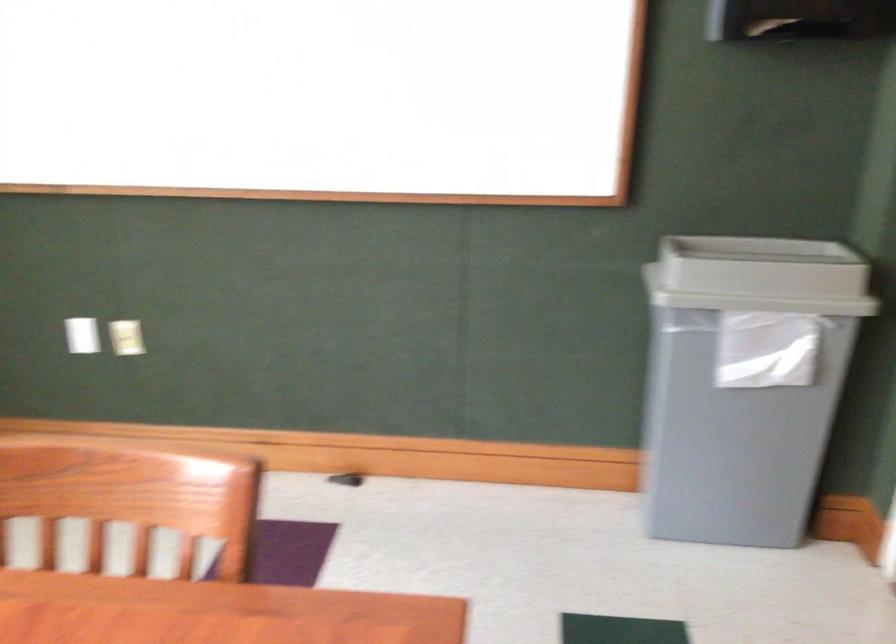
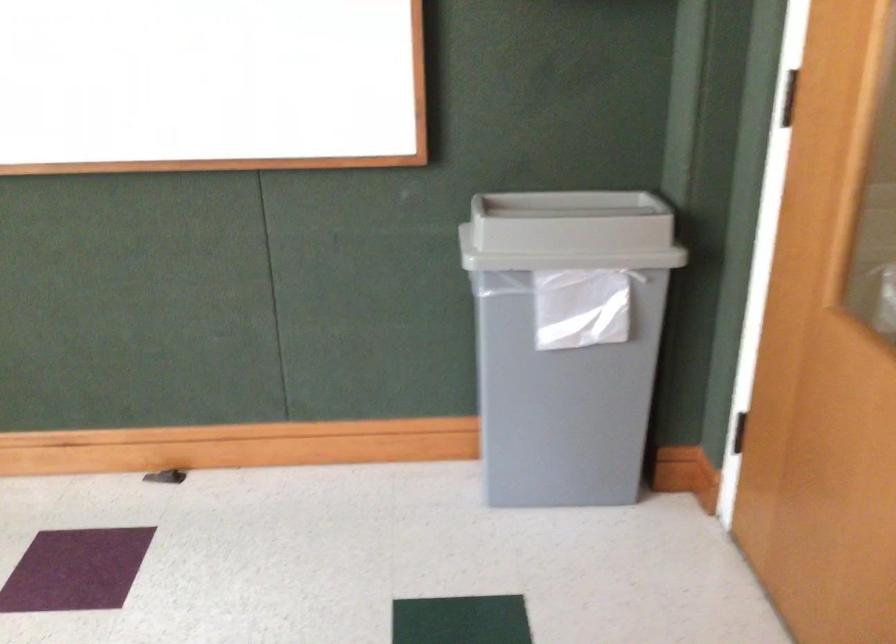
The images are taken continuously from a first-person perspective. In which direction are you moving?

The cameraman walked toward right, forward.